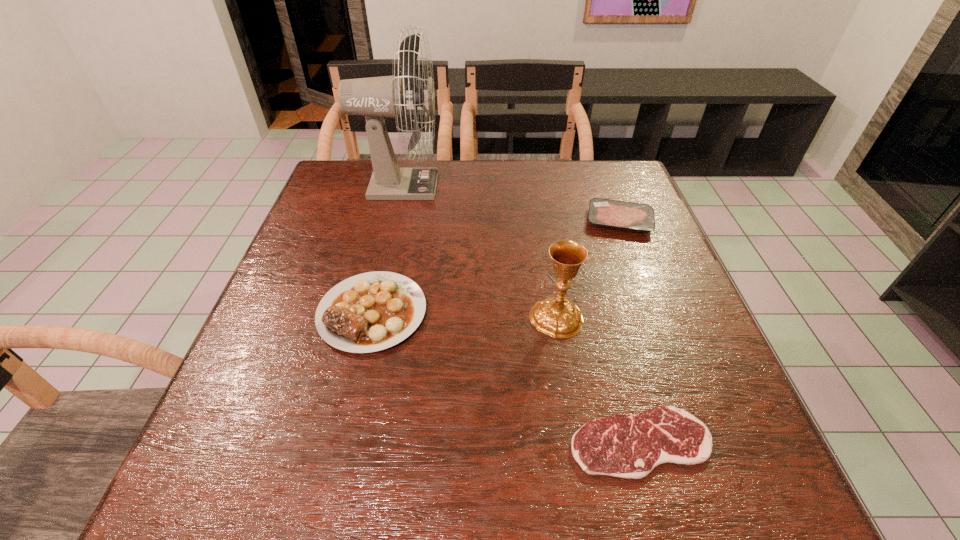
Find the location of a particular element. empty location between the farthest steak and the nearest object is located at coordinates (630, 332).

Where is `unoccupied position between the fan and the third tallest object`? The height and width of the screenshot is (540, 960). unoccupied position between the fan and the third tallest object is located at coordinates (386, 249).

Locate an element on the screen. free space between the farthest steak and the fan is located at coordinates (510, 204).

The width and height of the screenshot is (960, 540). Find the location of `object identified as the closest to the fourth shortest object`. object identified as the closest to the fourth shortest object is located at coordinates (628, 446).

The height and width of the screenshot is (540, 960). What are the coordinates of `object identified as the second closest to the farthest steak` in the screenshot? It's located at (375, 98).

Choose which steak is the second nearest neighbor to the fan. Please provide its 2D coordinates. Your answer should be formatted as a tuple, i.e. [(x, y)], where the tuple contains the x and y coordinates of a point satisfying the conditions above.

[(628, 216)]

Select which steak appears as the closest to the tallest steak. Please provide its 2D coordinates. Your answer should be formatted as a tuple, i.e. [(x, y)], where the tuple contains the x and y coordinates of a point satisfying the conditions above.

[(628, 446)]

You are a GUI agent. You are given a task and a screenshot of the screen. Output one action in this format:
    pyautogui.click(x=<x>, y=<y>)
    Task: Click on the blank space that satisfies the following two spatial constraints: 1. on the air flow direction of the third tallest object; 2. on the left side of the fan
    
    Given the screenshot: What is the action you would take?
    pyautogui.click(x=371, y=312)

You are a GUI agent. You are given a task and a screenshot of the screen. Output one action in this format:
    pyautogui.click(x=<x>, y=<y>)
    Task: Click on the vacant position in the image that satisfies the following two spatial constraints: 1. on the air flow direction of the fan; 2. on the right side of the nearest object
    
    Given the screenshot: What is the action you would take?
    pyautogui.click(x=340, y=442)

The width and height of the screenshot is (960, 540). I want to click on vacant space that satisfies the following two spatial constraints: 1. on the front side of the nearest steak; 2. on the right side of the chalice, so click(x=577, y=442).